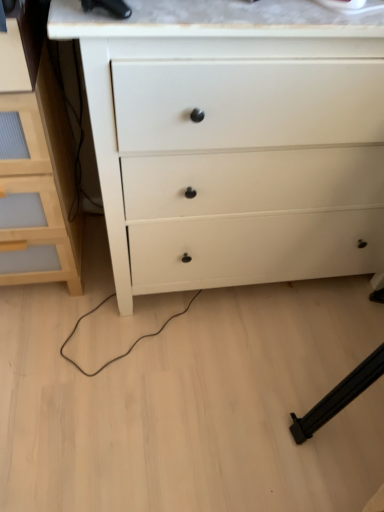
Locate an element on the screen. Image resolution: width=384 pixels, height=512 pixels. free spot in front of light wood chest of drawers at left, which is the 2th chest of drawers from right to left is located at coordinates (53, 350).